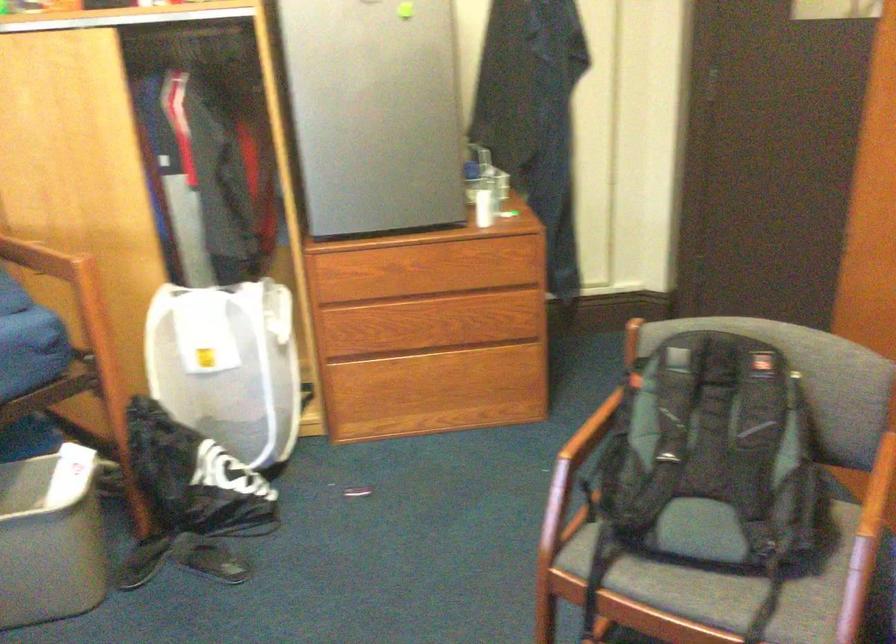
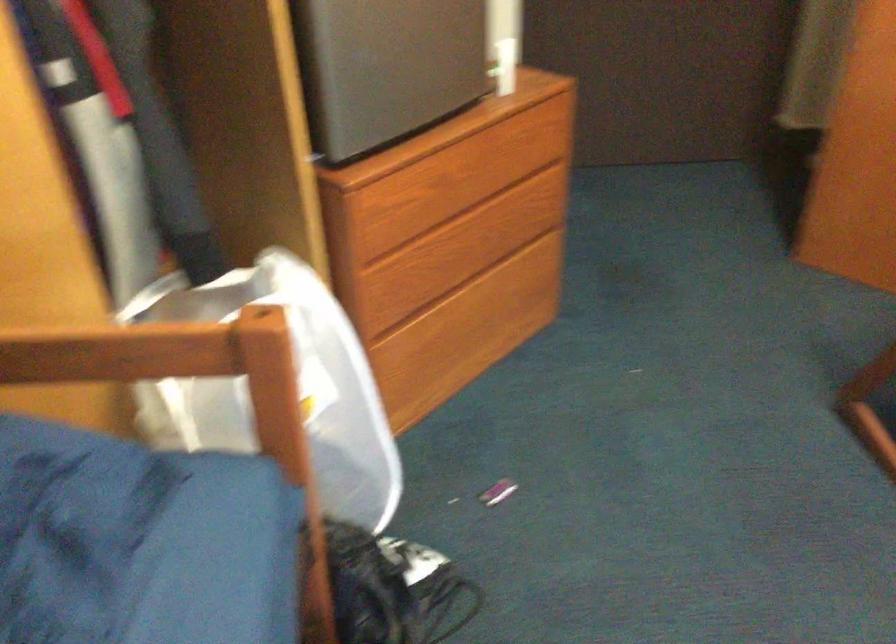
The point at (429, 313) is marked in the first image. Where is the corresponding point in the second image?

(469, 225)